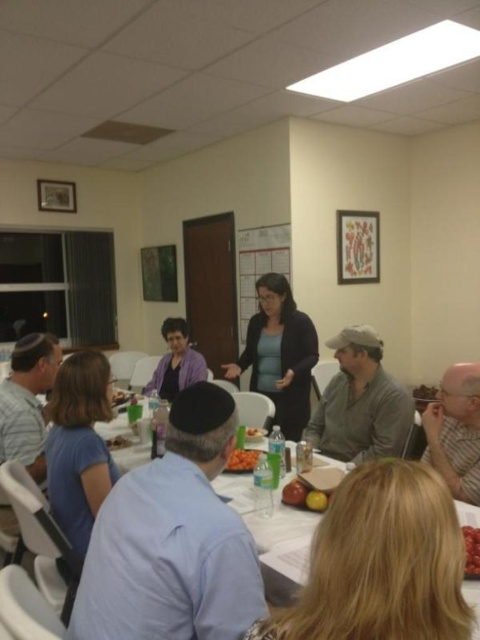
You are a guest at this event and want to write a note on the matte white board at center. However, you notice the gray striped shirt at lower right is blocking your access. Is the board above or below the shirt?

The gray striped shirt at lower right is positioned under the matte white board at center, so the board is above the shirt.

You are a photographer standing at the back of the room near the door. You want to take a photo of the smooth plastic container at center without including the blue cotton shirt at lower left in the frame. Is this possible given their positions?

The blue cotton shirt at lower left is located above the smooth plastic container at center. Since the shirt is above the container, positioning the camera to capture the container while avoiding the shirt might be challenging. However, by lowering the camera angle or adjusting the framing to exclude the upper area where the shirt is, it could be possible to photograph the smooth plastic container at center without including the blue cotton shirt at lower left.